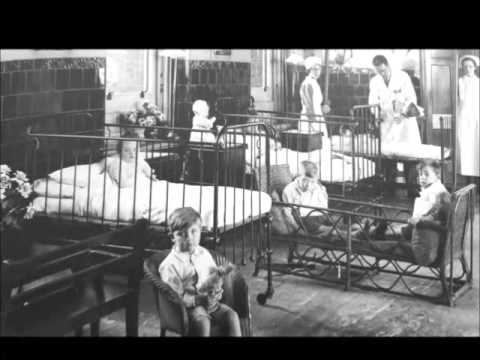
Find the location of a particular element. This screenshot has width=480, height=360. tiled wall is located at coordinates (20, 97), (51, 109), (84, 87), (205, 81), (239, 83), (234, 97), (346, 87), (340, 105).